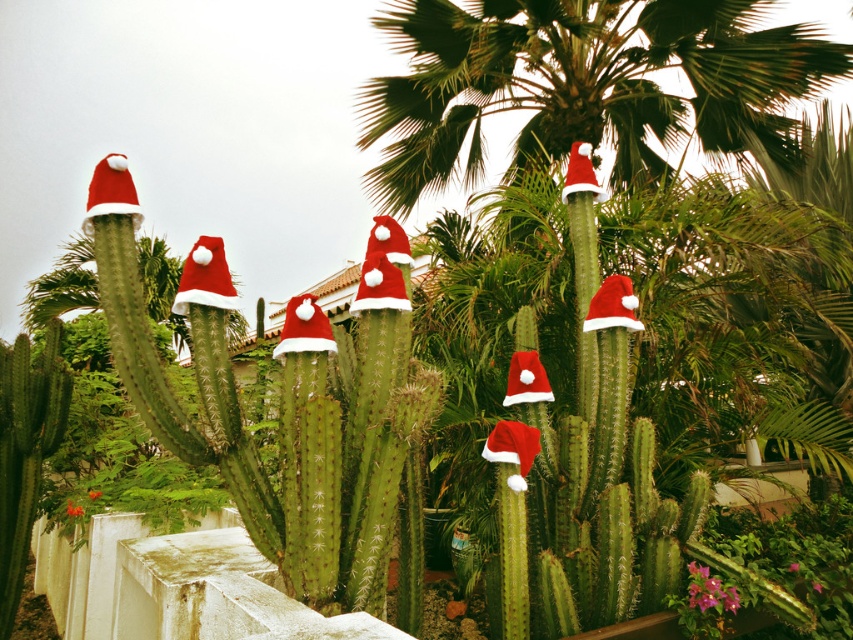
Which is in front, point (393, 305) or point (587, 156)?

Point (393, 305) is more forward.

Is point (381, 224) less distant than point (590, 186)?

Yes, it is in front of point (590, 186).

Is point (387, 289) less distant than point (584, 164)?

Yes, it is in front of point (584, 164).

This screenshot has height=640, width=853. I want to click on red matte santa hat at center, so click(x=383, y=268).

Who is lower down, red fabric santa hat at center or red matte santa hat at upper center?

red fabric santa hat at center is below.

Is red fabric santa hat at center further to camera compared to red matte santa hat at upper center?

No, it is in front of red matte santa hat at upper center.

Which is behind, point (618, 317) or point (575, 188)?

Positioned behind is point (575, 188).

Find the location of a particular element. The width and height of the screenshot is (853, 640). red fabric santa hat at center is located at coordinates [x=612, y=305].

At what (x,y) coordinates should I click in order to perform the action: click on red matte santa hat at center. Please return your answer as a coordinate pair (x, y). The height and width of the screenshot is (640, 853). Looking at the image, I should click on (383, 268).

Is red matte santa hat at center positioned behind red fabric santa hat at center?

No, red matte santa hat at center is in front of red fabric santa hat at center.

Does point (396, 241) come in front of point (595, 296)?

Yes.

This screenshot has height=640, width=853. Find the location of `red matte santa hat at center`. red matte santa hat at center is located at coordinates (383, 268).